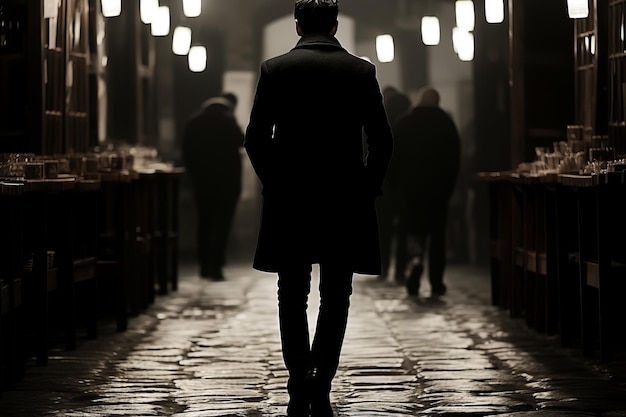
At what (x,y) coordinates should I click in order to perform the action: click on hanging lights. Please return your answer as a coordinate pair (x, y). The height and width of the screenshot is (417, 626). Looking at the image, I should click on (462, 50), (429, 30), (396, 44), (203, 53), (180, 45), (151, 26).